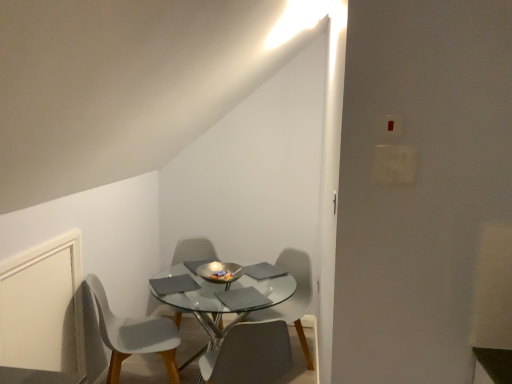
Question: Is shiny metallic bowl at center looking in the opposite direction of white plastic chair at center, which ranks as the third chair in right-to-left order?

Choices:
 (A) yes
 (B) no

Answer: (A)

Question: Can you confirm if shiny metallic bowl at center is bigger than white plastic chair at center, acting as the second chair starting from the left?

Choices:
 (A) no
 (B) yes

Answer: (A)

Question: Does shiny metallic bowl at center have a lesser height compared to white plastic chair at center, acting as the second chair starting from the left?

Choices:
 (A) yes
 (B) no

Answer: (A)

Question: Does shiny metallic bowl at center appear on the left side of white plastic chair at center, which ranks as the third chair in right-to-left order?

Choices:
 (A) yes
 (B) no

Answer: (B)

Question: From a real-world perspective, is shiny metallic bowl at center below white plastic chair at center, acting as the second chair starting from the left?

Choices:
 (A) no
 (B) yes

Answer: (A)

Question: Is white plastic chair at center, which ranks as the third chair in right-to-left order, completely or partially inside shiny metallic bowl at center?

Choices:
 (A) no
 (B) yes

Answer: (A)

Question: Does white plastic chair at lower left, which is the 1th chair in left-to-right order, have a lesser height compared to matte gray chair at center, positioned as the 3th chair in left-to-right order?

Choices:
 (A) yes
 (B) no

Answer: (B)

Question: Is white plastic chair at lower left, which is the 1th chair in left-to-right order, next to matte gray chair at center, positioned as the 3th chair in left-to-right order, and touching it?

Choices:
 (A) no
 (B) yes

Answer: (A)

Question: Is white plastic chair at lower left, which is the 1th chair in left-to-right order, at the left side of matte gray chair at center, which ranks as the second chair in right-to-left order?

Choices:
 (A) yes
 (B) no

Answer: (A)

Question: Does white plastic chair at lower left, which is the 1th chair in left-to-right order, have a greater height compared to matte gray chair at center, positioned as the 3th chair in left-to-right order?

Choices:
 (A) no
 (B) yes

Answer: (B)

Question: Is the depth of white plastic chair at lower left, which is the 1th chair in left-to-right order, greater than that of matte gray chair at center, which ranks as the second chair in right-to-left order?

Choices:
 (A) no
 (B) yes

Answer: (B)

Question: Are white plastic chair at lower left, which is the 1th chair in left-to-right order, and matte gray chair at center, positioned as the 3th chair in left-to-right order, far apart?

Choices:
 (A) no
 (B) yes

Answer: (A)

Question: Is matte gray chair at center, positioned as the 3th chair in left-to-right order, looking in the opposite direction of white plastic chair at center, which ranks as the third chair in right-to-left order?

Choices:
 (A) yes
 (B) no

Answer: (B)